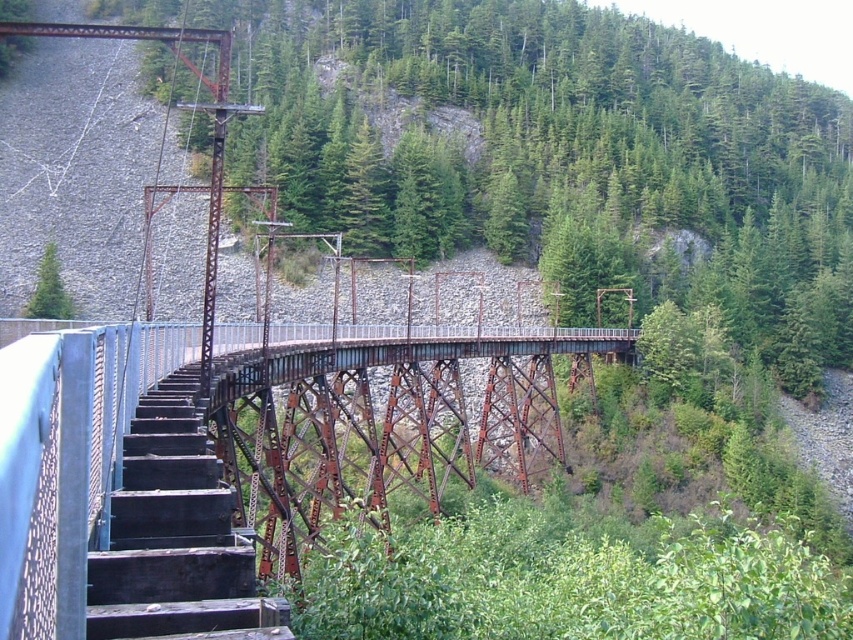
Question: Which object appears farthest from the camera in this image?

Choices:
 (A) rusty metal stairs at center
 (B) rusty metal bridge at center

Answer: (A)

Question: Which point appears closest to the camera in this image?

Choices:
 (A) (270, 620)
 (B) (321, 388)
 (C) (61, 296)

Answer: (A)

Question: Can you confirm if rusty metal stairs at center is positioned to the right of green matte tree at upper left?

Choices:
 (A) yes
 (B) no

Answer: (A)

Question: Which object is positioned closest to the rusty metal stairs at center?

Choices:
 (A) green matte tree at upper left
 (B) rusty metal bridge at center

Answer: (B)

Question: Can you confirm if rusty metal bridge at center is bigger than green matte tree at upper left?

Choices:
 (A) yes
 (B) no

Answer: (A)

Question: Considering the relative positions of rusty metal bridge at center and green matte tree at upper left in the image provided, where is rusty metal bridge at center located with respect to green matte tree at upper left?

Choices:
 (A) right
 (B) left

Answer: (A)